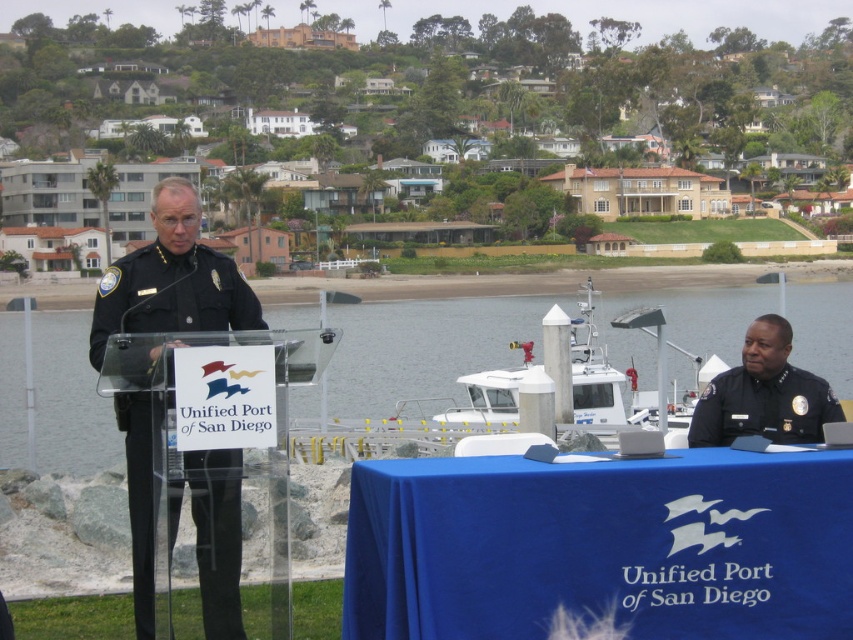
You are organizing a small event at the waterfront and need to place a decorative item between the black uniform at center and the white plastic boat at center. Given their sizes, which object should you place closer to the edge to ensure there is enough space?

The black uniform at center has a lesser width compared to the white plastic boat at center, so you should place the black uniform at center closer to the edge to accommodate the wider white plastic boat at center.

You are a photographer at the event and need to position your camera so that both the blue fabric table at lower right and the clear water at center are in the frame. Based on their positions, which object should you focus on first to ensure both are visible?

The blue fabric table at lower right is below the clear water at center. To ensure both are visible, focus on the clear water at center first as it is higher in the frame, allowing the table to naturally come into view below it.